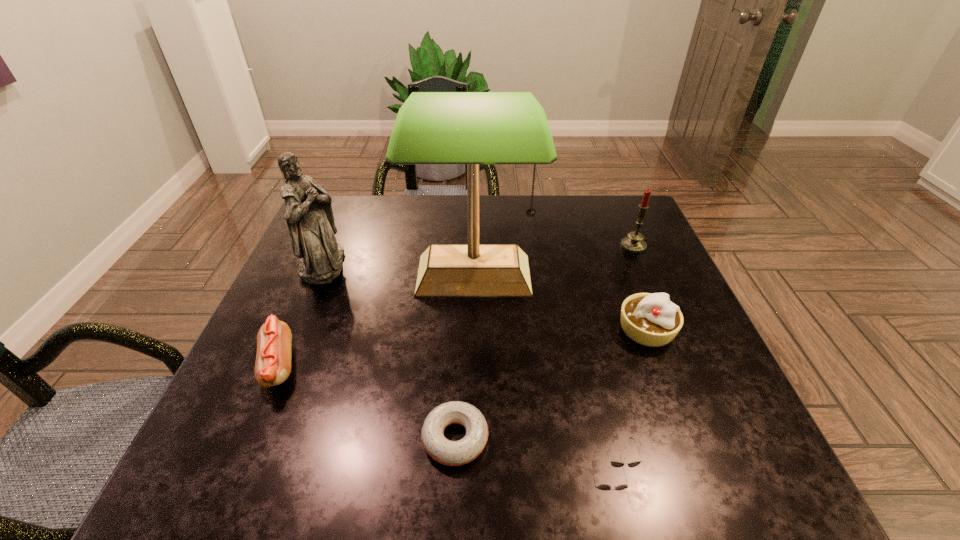
I want to click on whipped cream that is at the right edge, so click(649, 319).

I want to click on object at the far right corner, so click(x=633, y=243).

What are the coordinates of `vacant region at the far edge` in the screenshot? It's located at (564, 201).

The width and height of the screenshot is (960, 540). What are the coordinates of `vacant space at the near edge of the desktop` in the screenshot? It's located at (427, 465).

What are the coordinates of `vacant region at the left edge` in the screenshot? It's located at (344, 291).

Identify the location of blank space at the right edge. The height and width of the screenshot is (540, 960). (741, 430).

This screenshot has height=540, width=960. I want to click on vacant space at the far left corner of the desktop, so click(360, 221).

Where is `vacant space at the far right corner of the desktop`? vacant space at the far right corner of the desktop is located at coordinates click(x=614, y=223).

Image resolution: width=960 pixels, height=540 pixels. Find the location of `unoccupied area between the table lamp and the whipped cream`. unoccupied area between the table lamp and the whipped cream is located at coordinates (560, 302).

The image size is (960, 540). What are the coordinates of `free space that is in between the whipped cream and the third object from right to left` in the screenshot? It's located at (632, 396).